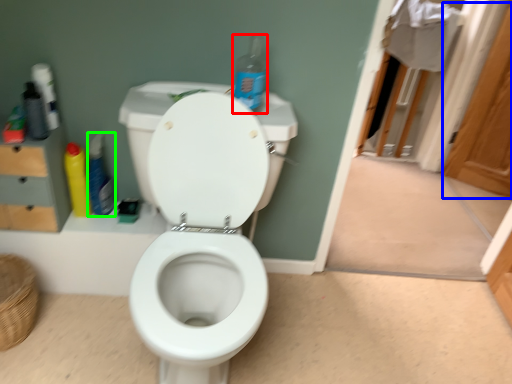
Question: Based on their relative distances, which object is farther from cleaning product (highlighted by a red box)? Choose from screen door (highlighted by a blue box) and cleaning product (highlighted by a green box).

Choices:
 (A) screen door
 (B) cleaning product

Answer: (A)